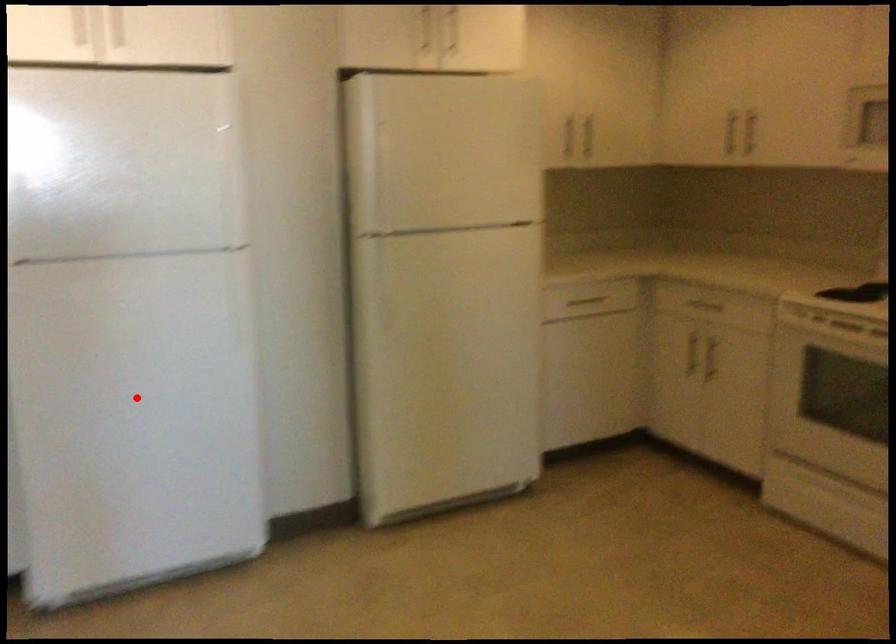
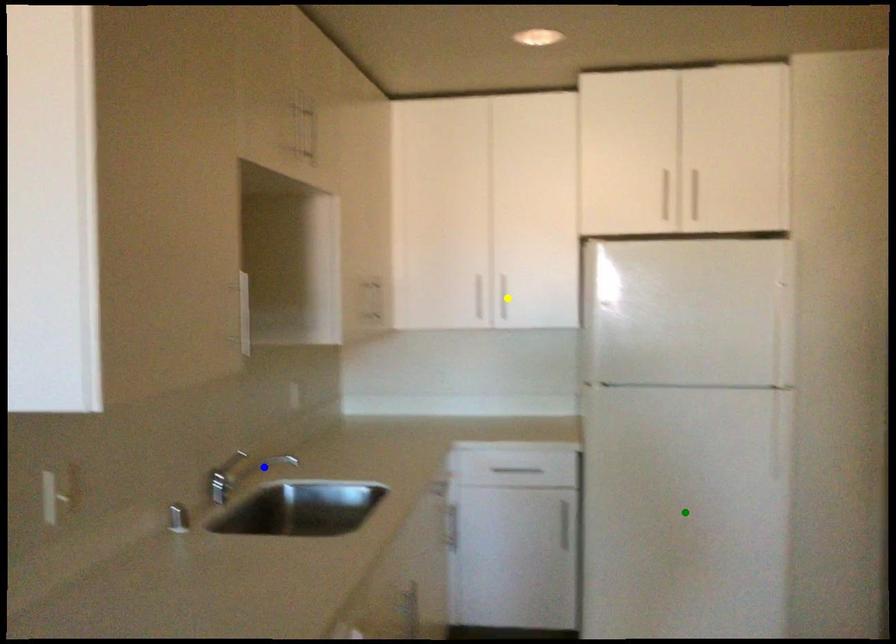
Question: I am providing you with two images of the same scene from different viewpoints. A red point is marked on the first image. You are given multiple points on the second image. Which spot in image 2 lines up with the point in image 1?

Choices:
 (A) yellow point
 (B) blue point
 (C) green point

Answer: (C)